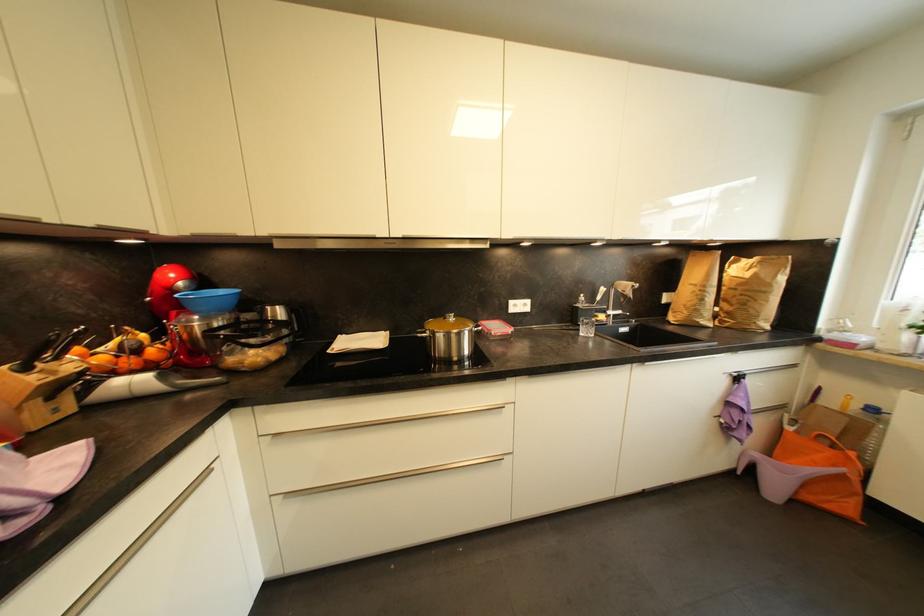
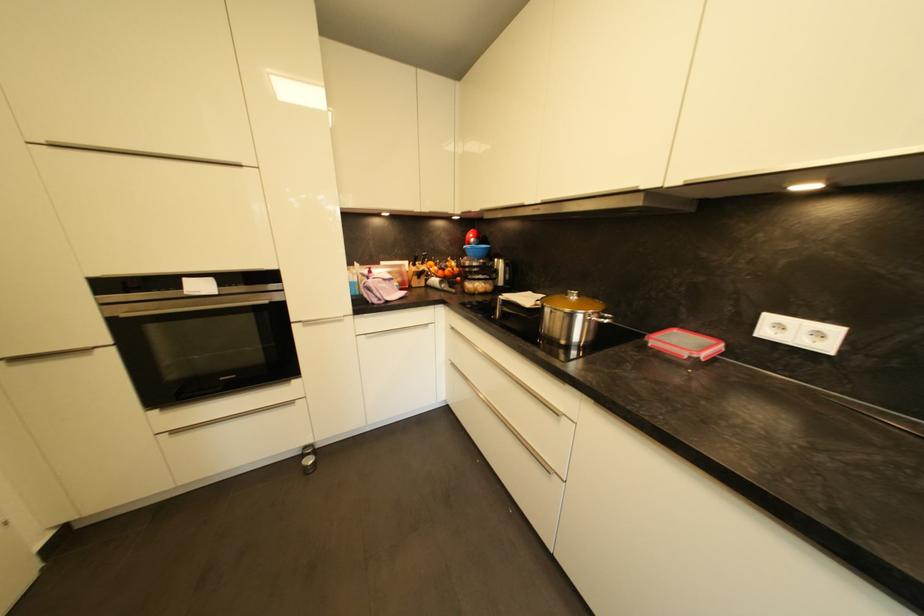
Question: Based on the continuous images, in which direction is the camera rotating? Reply with the corresponding letter.

Choices:
 (A) Left
 (B) Right
 (C) Up
 (D) Down

Answer: (A)